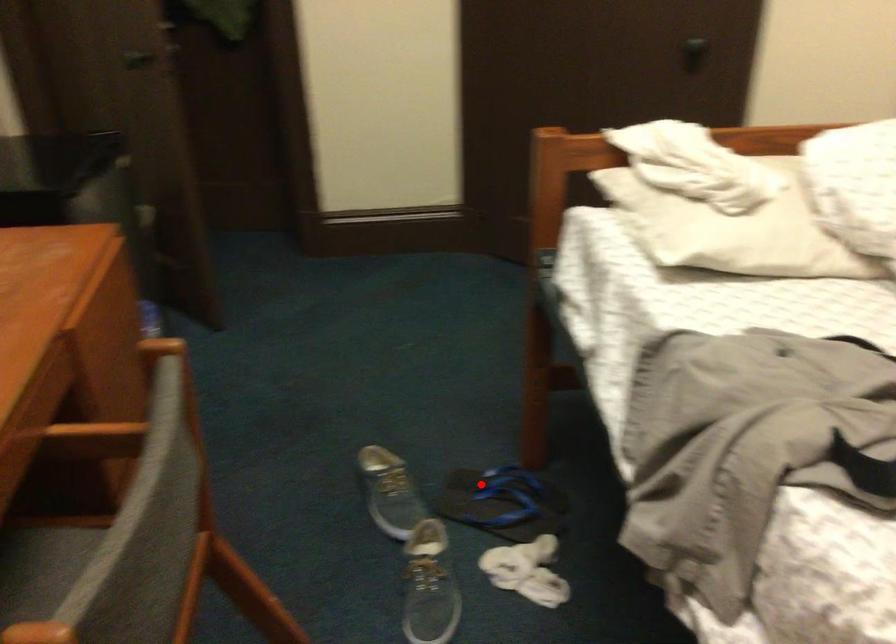
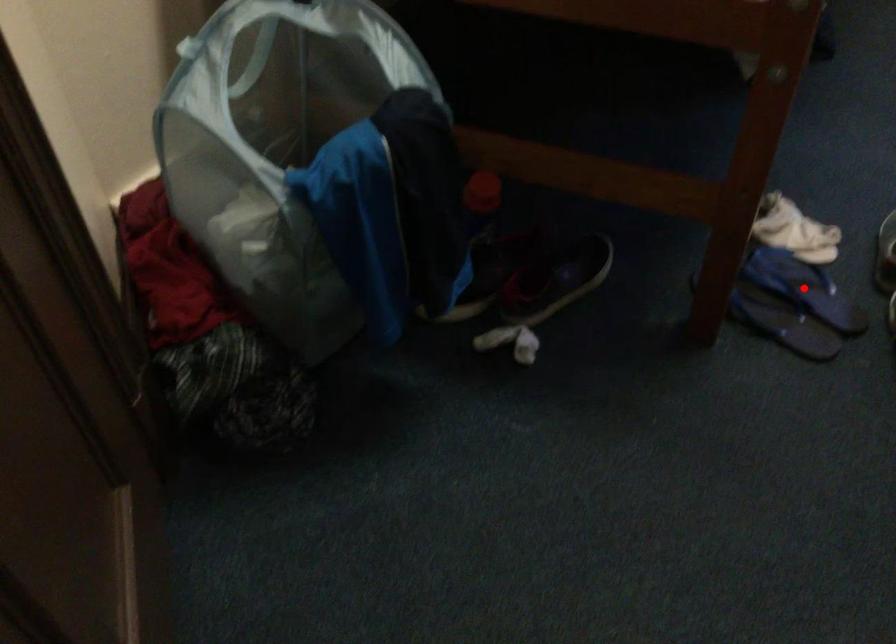
I am providing you with two images of the same scene from different viewpoints. A red point is marked on the first image and another point is marked on the second image. Does the point marked in image1 correspond to the same location as the one in image2?

No